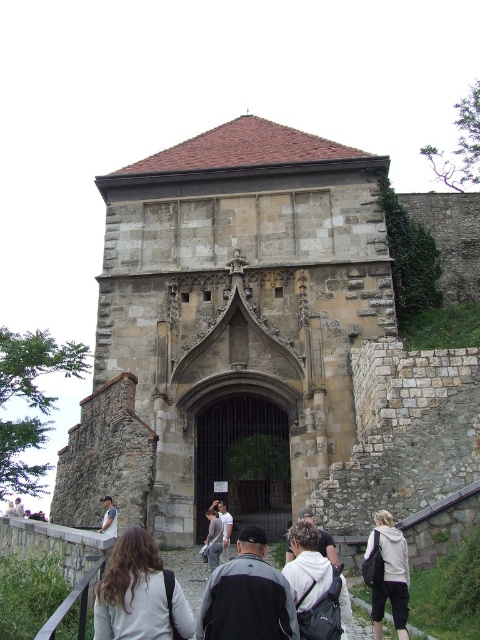
You are standing in front of the historic stone structure and want to take a photo. You notice two points marked on the structure. One is at coordinate point (346, 596) and the other at point (217, 534). Which point is closer to your camera when you take the photo?

Point (346, 596) is closer to the camera than point (217, 534).

You are standing in front of a historic stone structure and notice a gray fleece jacket at center and a stone gothic church at center. Which object is positioned to the right of the other?

The stone gothic church at center is to the right of gray fleece jacket at center.

You are standing in front of the stone gothic church at center and the dark gray fabric backpack at center. Which object is positioned to the right?

The dark gray fabric backpack at center is positioned to the right of the stone gothic church at center.